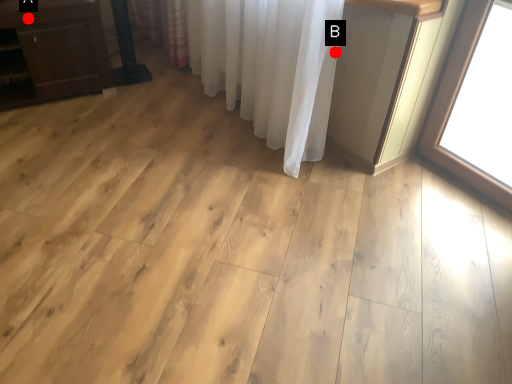
Question: Two points are circled on the image, labeled by A and B beside each circle. Among these points, which one is farthest from the camera?

Choices:
 (A) A is further
 (B) B is further

Answer: (A)